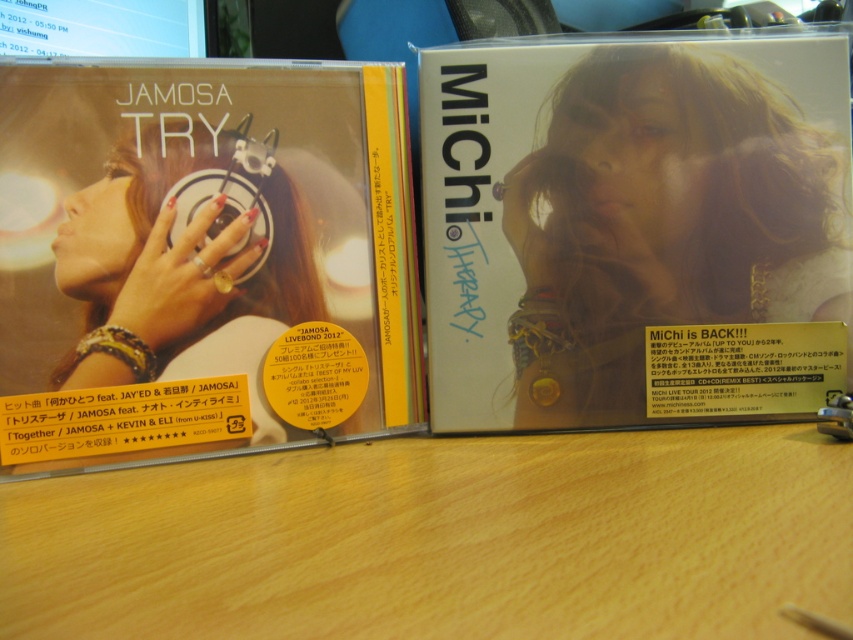
Who is taller, matte white cd at center or wooden table at center?

matte white cd at center is taller.

Which is behind, point (822, 401) or point (605, 608)?

Positioned behind is point (822, 401).

Does point (457, 410) come in front of point (842, 468)?

That is False.

In order to click on matte white cd at center in this screenshot , I will do `click(634, 227)`.

Is matte black cd at left thinner than matte white cd at center?

Yes.

Is point (347, 424) positioned in front of point (699, 387)?

Yes, point (347, 424) is closer to viewer.

Locate an element on the screen. matte black cd at left is located at coordinates (201, 259).

Locate an element on the screen. This screenshot has height=640, width=853. matte black cd at left is located at coordinates (201, 259).

Can you confirm if matte black cd at left is positioned above wooden table at center?

Correct, matte black cd at left is located above wooden table at center.

Which is behind, point (125, 236) or point (196, 576)?

Point (125, 236)

Is point (103, 387) positioned before point (345, 518)?

That is False.

Where is `matte black cd at left`? Image resolution: width=853 pixels, height=640 pixels. matte black cd at left is located at coordinates (201, 259).